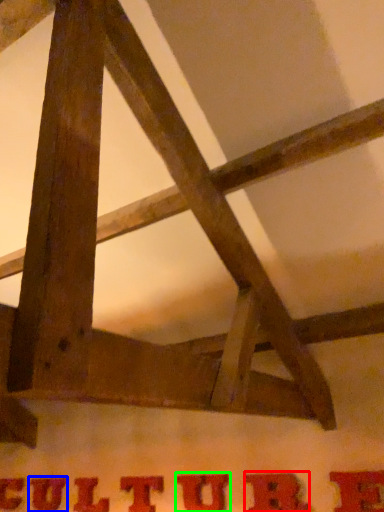
Question: Which object is positioned closest to letter (highlighted by a red box)? Select from letter (highlighted by a blue box) and letter (highlighted by a green box).

Choices:
 (A) letter
 (B) letter

Answer: (B)